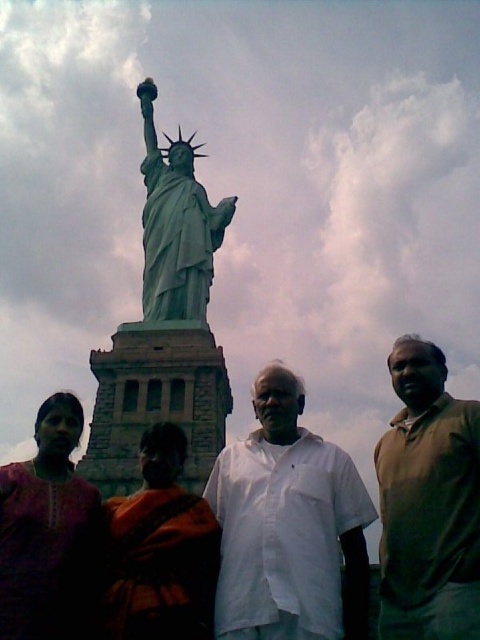
You are a photographer planning to take a photo of the purple fabric at lower left and the orange fabric at center. Based on their positions, which fabric should you focus on first if you want to capture both in a single frame without moving the camera?

The purple fabric at lower left should be focused on first since it is positioned to the left of the orange fabric at center, allowing both to be captured in the frame by adjusting the focus from left to right.

You are a photographer taking a photo of the Statue of Liberty. In the image, you notice two elements in the foreground. The first is a brown fabric shirt at center, and the second is a purple fabric at lower left. Which of these elements is positioned higher in the frame?

The brown fabric shirt at center is located above the purple fabric at lower left, so it is positioned higher in the frame.